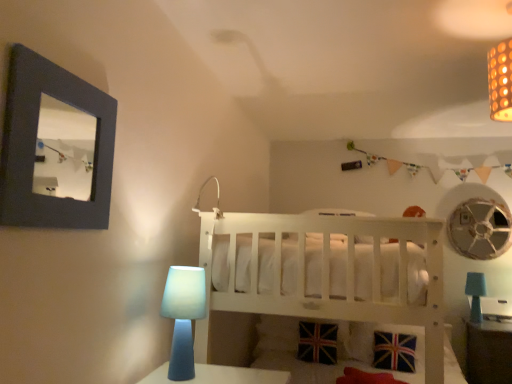
Question: From the image's perspective, is blue matte table lamp at lower right, which appears as the 1th table lamp when ordered from the bottom, beneath metallic silver mechanical fan at upper right?

Choices:
 (A) yes
 (B) no

Answer: (A)

Question: Is blue matte table lamp at lower right, which ranks as the 2th table lamp in top-to-bottom order, placed right next to metallic silver mechanical fan at upper right?

Choices:
 (A) yes
 (B) no

Answer: (B)

Question: Is blue matte table lamp at lower right, which ranks as the 2th table lamp in top-to-bottom order, wider than metallic silver mechanical fan at upper right?

Choices:
 (A) yes
 (B) no

Answer: (A)

Question: Is blue matte table lamp at lower right, which appears as the 2th table lamp when viewed from the front, to the right of metallic silver mechanical fan at upper right from the viewer's perspective?

Choices:
 (A) no
 (B) yes

Answer: (A)

Question: From a real-world perspective, is blue matte table lamp at lower right, positioned as the first table lamp in back-to-front order, below metallic silver mechanical fan at upper right?

Choices:
 (A) yes
 (B) no

Answer: (A)

Question: Is blue matte table lamp at lower right, which ranks as the 2th table lamp in top-to-bottom order, outside of metallic silver mechanical fan at upper right?

Choices:
 (A) no
 (B) yes

Answer: (B)

Question: Does dark gray matte picture frame at upper left have a smaller size compared to matte brown table at lower right?

Choices:
 (A) yes
 (B) no

Answer: (A)

Question: Considering the relative sizes of dark gray matte picture frame at upper left and matte brown table at lower right in the image provided, is dark gray matte picture frame at upper left thinner than matte brown table at lower right?

Choices:
 (A) yes
 (B) no

Answer: (A)

Question: Is matte brown table at lower right at the back of dark gray matte picture frame at upper left?

Choices:
 (A) no
 (B) yes

Answer: (A)

Question: Is the depth of dark gray matte picture frame at upper left less than that of matte brown table at lower right?

Choices:
 (A) no
 (B) yes

Answer: (B)

Question: Is the depth of dark gray matte picture frame at upper left greater than that of matte brown table at lower right?

Choices:
 (A) yes
 (B) no

Answer: (B)

Question: Does dark gray matte picture frame at upper left have a larger size compared to matte brown table at lower right?

Choices:
 (A) yes
 (B) no

Answer: (B)

Question: Can you confirm if union jack fabric pillow at lower center is bigger than blue matte table lamp at lower left, marked as the first table lamp in a left-to-right arrangement?

Choices:
 (A) no
 (B) yes

Answer: (B)